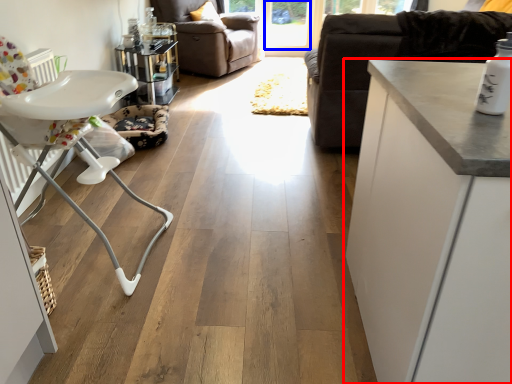
Question: Which object is further to the camera taking this photo, cabinetry (highlighted by a red box) or window screen (highlighted by a blue box)?

Choices:
 (A) cabinetry
 (B) window screen

Answer: (B)